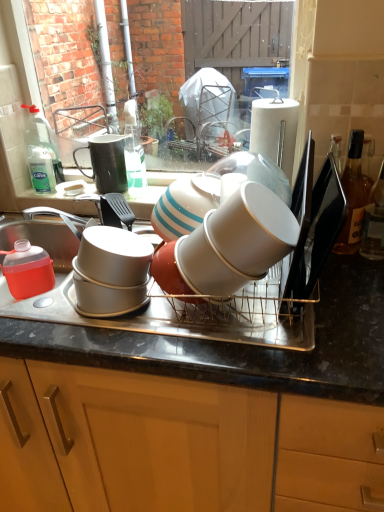
Question: Considering the positions of translucent plastic jug at left, the fourth tableware from the right, and metallic gray tray at center in the image, is translucent plastic jug at left, the fourth tableware from the right, taller or shorter than metallic gray tray at center?

Choices:
 (A) short
 (B) tall

Answer: (A)

Question: In terms of size, does translucent plastic jug at left, marked as the third tableware in a front-to-back arrangement, appear bigger or smaller than metallic gray tray at center?

Choices:
 (A) small
 (B) big

Answer: (A)

Question: Which of these objects is positioned closest to the metallic gray bowls at left?

Choices:
 (A) matte black mug at upper center, which ranks as the 1th tableware in back-to-front order
 (B) translucent glass bottle at right, acting as the 1th bottle starting from the right
 (C) white glossy cup at center, the 4th tableware from the back
 (D) brown glass bottle at right, which ranks as the 1th bottle in left-to-right order
 (E) white glossy cup at center, the 2th tableware from the right

Answer: (A)

Question: Estimate the real-world distances between objects in this image. Which object is farther from the translucent glass bottle at right, acting as the 1th bottle starting from the right?

Choices:
 (A) white glossy cup at center, which is counted as the 4th tableware, starting from the left
 (B) white glossy cup at center, the 3th tableware in the back-to-front sequence
 (C) brown glass bottle at right, positioned as the second bottle in right-to-left order
 (D) metallic gray bowls at left
 (E) matte black mug at upper center, which ranks as the 1th tableware in back-to-front order

Answer: (E)